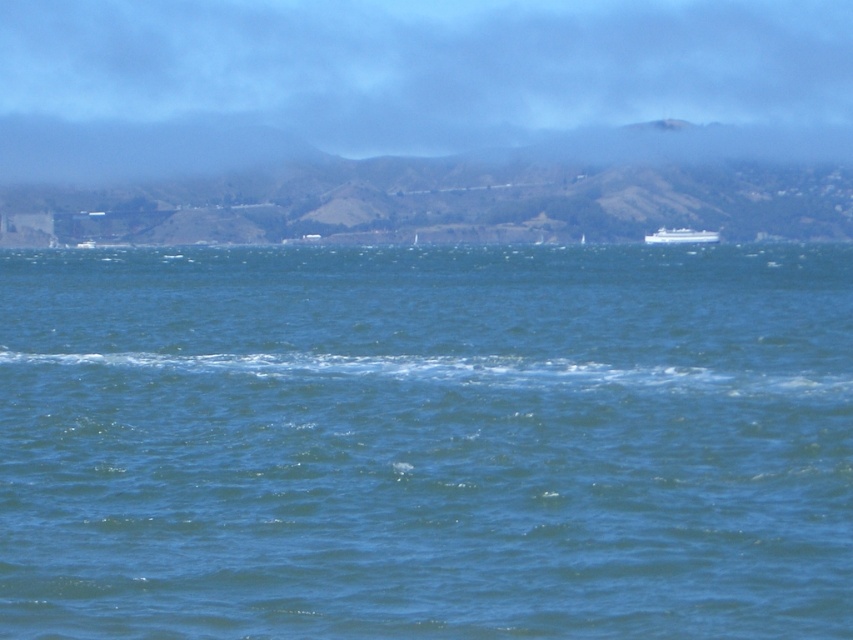
You are a drone operator trying to capture a photo of the blue liquid water at center and the green grassy hill at center. The drone has a maximum range of 150 meters. Can the drone capture both objects in a single photo without moving closer than 10 meters to either object?

The blue liquid water at center is 131.80 meters from the green grassy hill at center. Since the drone must stay at least 10 meters away from each object, the minimum distance required is 131.80 meters plus 10 meters plus 10 meters, totaling 151.80 meters. The drone can only reach 150 meters, so it cannot capture both objects in a single photo without moving closer than 10 meters to either object.